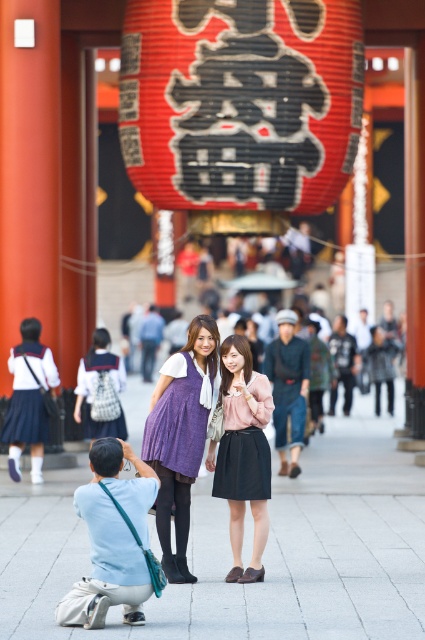
Question: Among these objects, which one is farthest from the camera?

Choices:
 (A) red paper lantern at upper center
 (B) purple textured dress at center

Answer: (A)

Question: Does purple textured dress at center lie behind matte purple dress at center?

Choices:
 (A) no
 (B) yes

Answer: (A)

Question: Where is red paper lantern at upper center located in relation to matte purple dress at center in the image?

Choices:
 (A) left
 (B) right

Answer: (B)

Question: Can you confirm if red paper lantern at upper center is positioned to the left of matte purple dress at center?

Choices:
 (A) yes
 (B) no

Answer: (B)

Question: Which object appears closest to the camera in this image?

Choices:
 (A) matte purple dress at center
 (B) purple textured dress at center
 (C) red paper lantern at upper center

Answer: (B)

Question: Considering the real-world distances, which object is closest to the purple textured dress at center?

Choices:
 (A) red paper lantern at upper center
 (B) matte purple dress at center

Answer: (B)